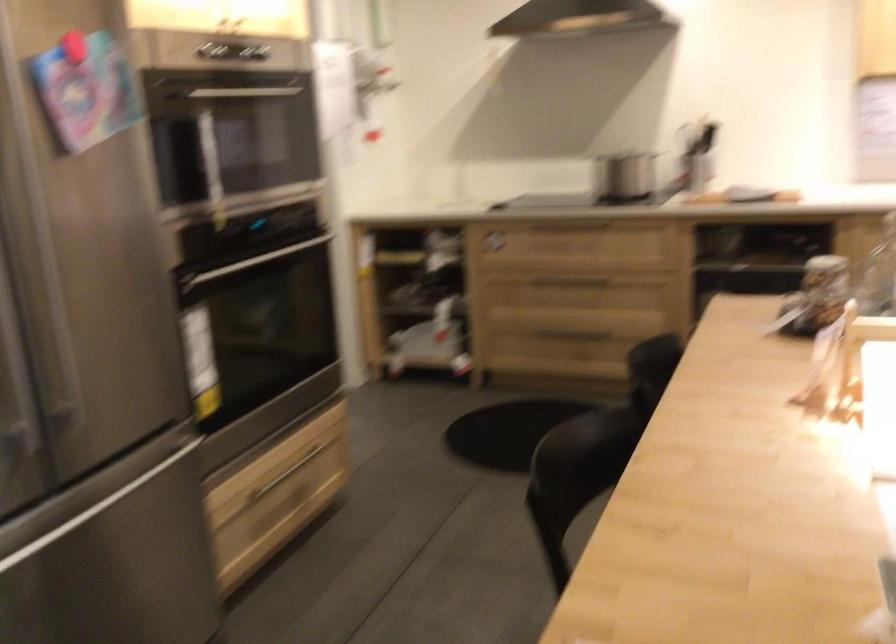
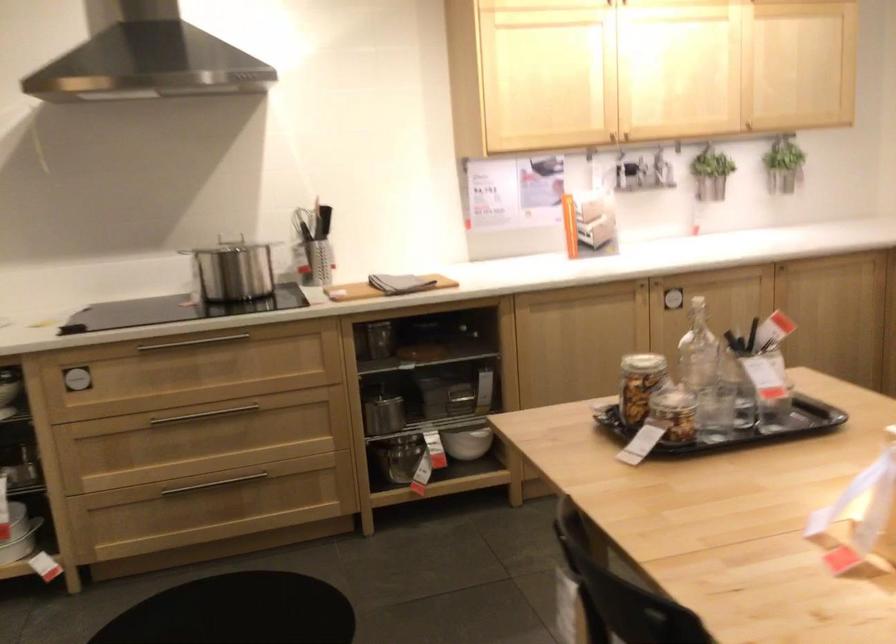
In the second image, find the point that corresponds to point 570,216 in the first image.

(194, 343)